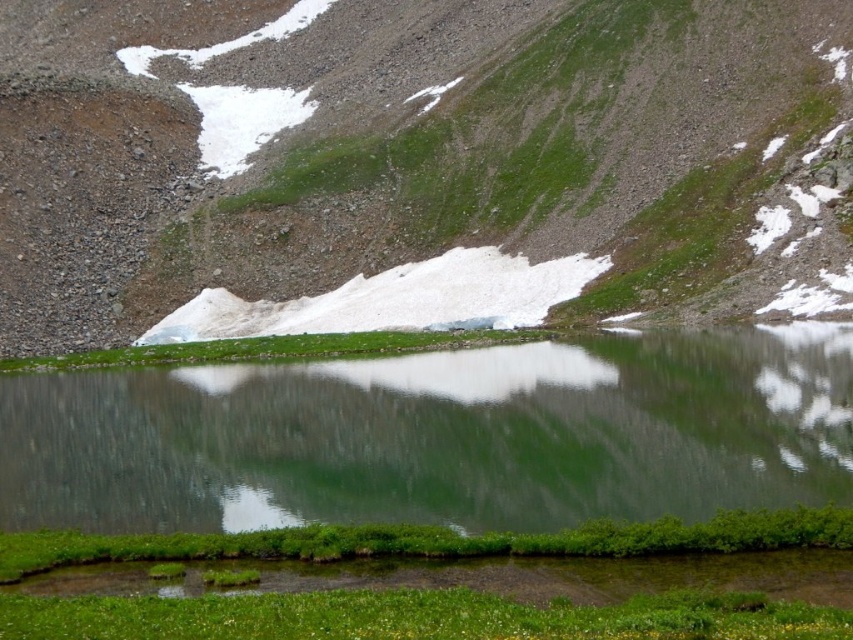
Describe the element at coordinates (421, 163) in the screenshot. I see `green grassy hillside at center` at that location.

In the scene shown: Which is more to the left, green grassy hillside at center or green reflective water at center?

From the viewer's perspective, green grassy hillside at center appears more on the left side.

What do you see at coordinates (421, 163) in the screenshot?
I see `green grassy hillside at center` at bounding box center [421, 163].

This screenshot has height=640, width=853. I want to click on green grassy hillside at center, so click(x=421, y=163).